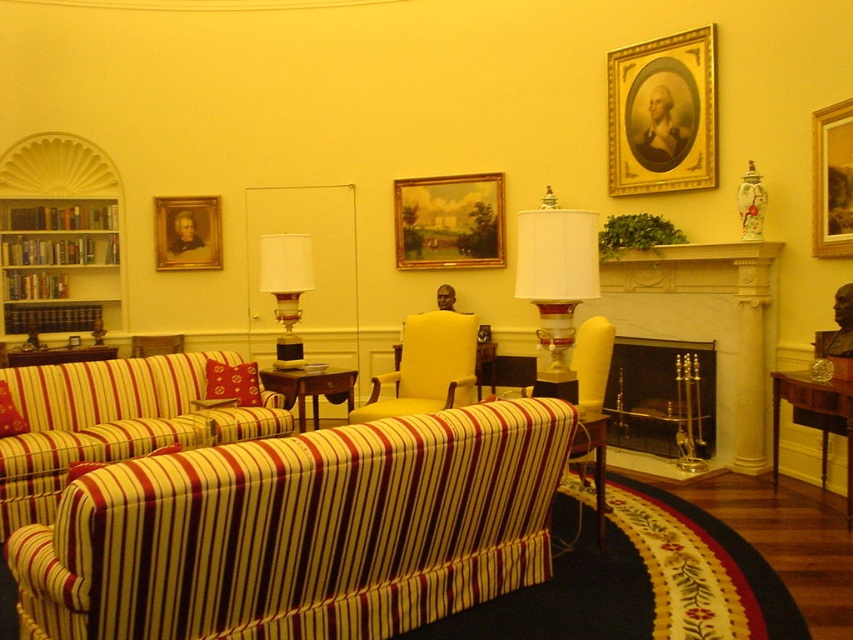
Question: Is yellow striped fabric couch at lower left above goldmetallicpicture frame at upper center?

Choices:
 (A) no
 (B) yes

Answer: (A)

Question: Observing the image, what is the correct spatial positioning of striped fabric couch at left in reference to goldmetallicpicture frame at upper center?

Choices:
 (A) below
 (B) above

Answer: (A)

Question: Which object is farther from the camera taking this photo?

Choices:
 (A) matte yellow armchair at center
 (B) wooden bookshelf at left
 (C) gold-framed painting at upper right
 (D) black glass fireplace at center

Answer: (B)

Question: Considering the relative positions of yellow striped fabric couch at lower left and gold-framed portrait at upper left in the image provided, where is yellow striped fabric couch at lower left located with respect to gold-framed portrait at upper left?

Choices:
 (A) right
 (B) left

Answer: (A)

Question: Which point is closer to the camera?

Choices:
 (A) 50,506
 (B) 440,588

Answer: (B)

Question: Which of the following is the closest to the observer?

Choices:
 (A) (846, 401)
 (B) (821, 131)
 (C) (310, 284)

Answer: (A)